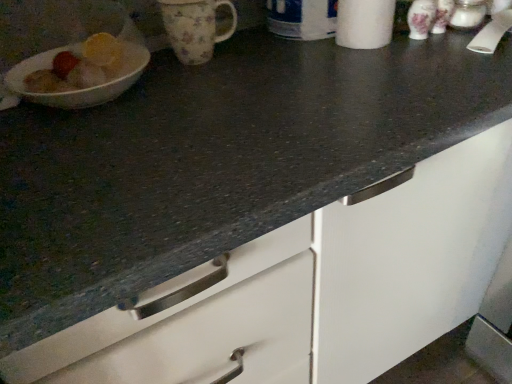
Image resolution: width=512 pixels, height=384 pixels. What do you see at coordinates (364, 23) in the screenshot?
I see `white paper towel at upper right` at bounding box center [364, 23].

Image resolution: width=512 pixels, height=384 pixels. I want to click on white paper towel at upper right, so click(x=364, y=23).

Describe the element at coordinates (194, 28) in the screenshot. The width and height of the screenshot is (512, 384). I see `floral ceramic mug at upper center` at that location.

In order to face floral ceramic mug at upper center, should I rotate leftwards or rightwards?

You should rotate left by 7.373 degrees.

Identify the location of floral ceramic mug at upper center. The width and height of the screenshot is (512, 384). coord(194,28).

You are a GUI agent. You are given a task and a screenshot of the screen. Output one action in this format:
    pyautogui.click(x=<x>, y=<y>)
    Task: Click on the white paper towel at upper right
    This screenshot has height=384, width=512.
    Given the screenshot: What is the action you would take?
    pyautogui.click(x=364, y=23)

Considering the relative positions of floral ceramic mug at upper center and white paper towel at upper right in the image provided, is floral ceramic mug at upper center to the left of white paper towel at upper right from the viewer's perspective?

Indeed, floral ceramic mug at upper center is positioned on the left side of white paper towel at upper right.

Considering the relative positions of floral ceramic mug at upper center and white paper towel at upper right in the image provided, is floral ceramic mug at upper center in front of white paper towel at upper right?

No, the depth of floral ceramic mug at upper center is greater than that of white paper towel at upper right.

Is point (185, 5) farther from viewer compared to point (366, 1)?

No, (185, 5) is in front of (366, 1).

From the picture: From the image's perspective, between floral ceramic mug at upper center and white paper towel at upper right, which one is located above?

white paper towel at upper right, from the image's perspective.

From a real-world perspective, which object stands above the other?

white paper towel at upper right, from a real-world perspective.

Which object is thinner, floral ceramic mug at upper center or white paper towel at upper right?

white paper towel at upper right is thinner.

Considering the sizes of objects floral ceramic mug at upper center and white paper towel at upper right in the image provided, who is shorter, floral ceramic mug at upper center or white paper towel at upper right?

floral ceramic mug at upper center.

Considering the sizes of objects floral ceramic mug at upper center and white paper towel at upper right in the image provided, who is smaller, floral ceramic mug at upper center or white paper towel at upper right?

floral ceramic mug at upper center.

Is floral ceramic mug at upper center not inside white paper towel at upper right?

Yes, floral ceramic mug at upper center is not within white paper towel at upper right.

From the picture: Is there a large distance between floral ceramic mug at upper center and white paper towel at upper right?

That's not correct — floral ceramic mug at upper center is a little close to white paper towel at upper right.

Is floral ceramic mug at upper center facing away from white paper towel at upper right?

No, floral ceramic mug at upper center is not facing the opposite direction of white paper towel at upper right.

What's the angular difference between floral ceramic mug at upper center and white paper towel at upper right's facing directions?

The angular difference between floral ceramic mug at upper center and white paper towel at upper right is 0.000432 degrees.

Identify the location of paper towel above the floral ceramic mug at upper center (from the image's perspective). (364, 23).

Considering the positions of objects white paper towel at upper right and floral ceramic mug at upper center in the image provided, who is more to the left, white paper towel at upper right or floral ceramic mug at upper center?

Positioned to the left is floral ceramic mug at upper center.

Is white paper towel at upper right further to the viewer compared to floral ceramic mug at upper center?

No, the depth of white paper towel at upper right is less than that of floral ceramic mug at upper center.

Which is behind, point (384, 21) or point (176, 17)?

Point (384, 21)

From the image's perspective, relative to floral ceramic mug at upper center, is white paper towel at upper right above or below?

Clearly, from the image's perspective, white paper towel at upper right is above floral ceramic mug at upper center.

From a real-world perspective, is white paper towel at upper right physically above floral ceramic mug at upper center?

Yes.

Between white paper towel at upper right and floral ceramic mug at upper center, which one has larger width?

Wider between the two is floral ceramic mug at upper center.

Does white paper towel at upper right have a greater height compared to floral ceramic mug at upper center?

Yes, white paper towel at upper right is taller than floral ceramic mug at upper center.

Which of these two, white paper towel at upper right or floral ceramic mug at upper center, is bigger?

Bigger between the two is white paper towel at upper right.

Is white paper towel at upper right inside or outside of floral ceramic mug at upper center?

white paper towel at upper right exists outside the volume of floral ceramic mug at upper center.

Is white paper towel at upper right beside floral ceramic mug at upper center?

No, white paper towel at upper right is not with floral ceramic mug at upper center.

Could you tell me if white paper towel at upper right is turned towards floral ceramic mug at upper center?

No, white paper towel at upper right is not oriented towards floral ceramic mug at upper center.

How many degrees apart are the facing directions of white paper towel at upper right and floral ceramic mug at upper center?

The angle between the facing direction of white paper towel at upper right and the facing direction of floral ceramic mug at upper center is 0.000432 degrees.

Find the location of `mug below the white paper towel at upper right (from the image's perspective)`. mug below the white paper towel at upper right (from the image's perspective) is located at coordinates (194, 28).

This screenshot has width=512, height=384. In the image, there is a white paper towel at upper right. What are the coordinates of `mug below it (from a real-world perspective)` in the screenshot? It's located at point(194,28).

Locate an element on the screen. This screenshot has height=384, width=512. paper towel lying above the floral ceramic mug at upper center (from the image's perspective) is located at coordinates (364, 23).